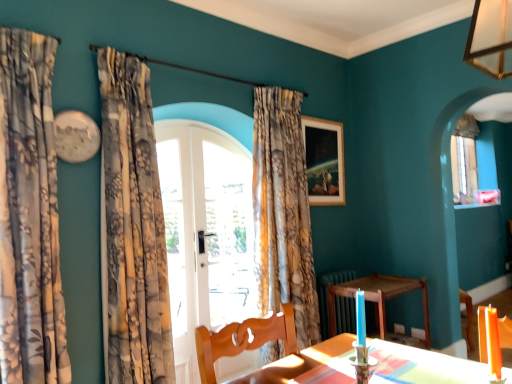
Question: Is clear glass door at center looking in the opposite direction of floral fabric curtain at center, the 1th curtain in the back-to-front sequence?

Choices:
 (A) yes
 (B) no

Answer: (B)

Question: Is clear glass door at center not within floral fabric curtain at center, which ranks as the third curtain in front-to-back order?

Choices:
 (A) no
 (B) yes

Answer: (B)

Question: Considering the relative sizes of clear glass door at center and floral fabric curtain at center, marked as the 1th curtain in a right-to-left arrangement, in the image provided, is clear glass door at center taller than floral fabric curtain at center, marked as the 1th curtain in a right-to-left arrangement,?

Choices:
 (A) no
 (B) yes

Answer: (A)

Question: From the image's perspective, would you say clear glass door at center is shown under floral fabric curtain at center, the 1th curtain in the back-to-front sequence?

Choices:
 (A) yes
 (B) no

Answer: (B)

Question: Does clear glass door at center have a smaller size compared to floral fabric curtain at center, marked as the 1th curtain in a right-to-left arrangement?

Choices:
 (A) no
 (B) yes

Answer: (B)

Question: Is wooden table at lower center in front of or behind floral fabric curtain at center, which ranks as the third curtain in front-to-back order, in the image?

Choices:
 (A) front
 (B) behind

Answer: (B)

Question: From a real-world perspective, is wooden table at lower center positioned above or below floral fabric curtain at center, which ranks as the third curtain in front-to-back order?

Choices:
 (A) above
 (B) below

Answer: (B)

Question: Would you say wooden table at lower center is inside or outside floral fabric curtain at center, which ranks as the third curtain in front-to-back order?

Choices:
 (A) inside
 (B) outside

Answer: (B)

Question: Considering the positions of wooden table at lower center and floral fabric curtain at center, the 1th curtain in the back-to-front sequence, in the image, is wooden table at lower center wider or thinner than floral fabric curtain at center, the 1th curtain in the back-to-front sequence,?

Choices:
 (A) thin
 (B) wide

Answer: (A)

Question: Is orange wax candle at lower right in front of or behind wooden picture frame at upper center in the image?

Choices:
 (A) front
 (B) behind

Answer: (A)

Question: From the image's perspective, is orange wax candle at lower right located above or below wooden picture frame at upper center?

Choices:
 (A) below
 (B) above

Answer: (A)

Question: From a real-world perspective, relative to wooden picture frame at upper center, is orange wax candle at lower right vertically above or below?

Choices:
 (A) above
 (B) below

Answer: (B)

Question: Does point (483, 324) appear closer or farther from the camera than point (314, 198)?

Choices:
 (A) farther
 (B) closer

Answer: (B)

Question: From a real-world perspective, is orange wax candle at lower right above or below wooden table at lower center?

Choices:
 (A) below
 (B) above

Answer: (B)

Question: Considering the relative positions of orange wax candle at lower right and wooden table at lower center in the image provided, is orange wax candle at lower right to the left or to the right of wooden table at lower center?

Choices:
 (A) right
 (B) left

Answer: (B)